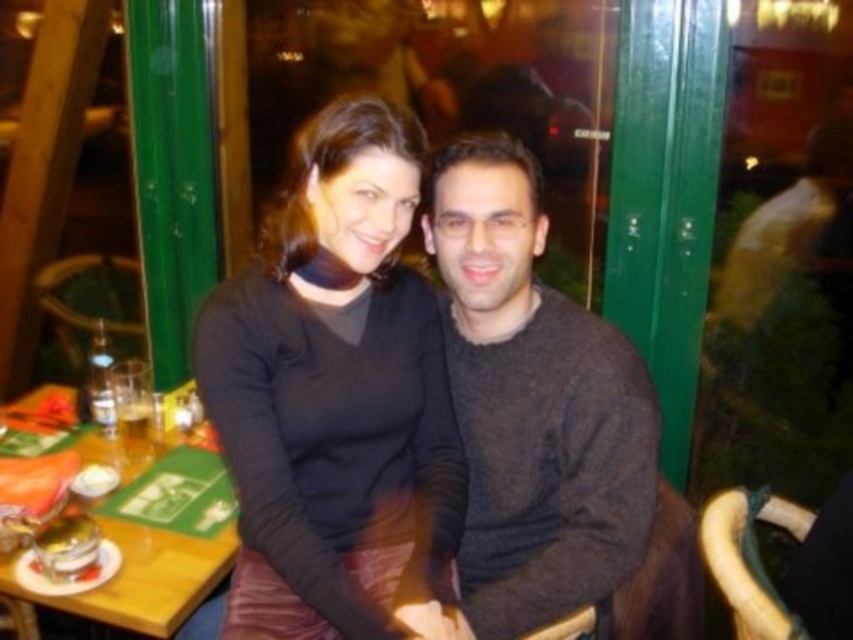
Question: Which of the following is the farthest from the observer?

Choices:
 (A) (398, 168)
 (B) (625, 394)
 (C) (161, 625)

Answer: (B)

Question: Which point appears closest to the camera in this image?

Choices:
 (A) (67, 390)
 (B) (515, 579)

Answer: (B)

Question: Is black matte sweater at center below wooden table at lower left?

Choices:
 (A) yes
 (B) no

Answer: (B)

Question: Is black matte sweater at center wider than wooden table at lower left?

Choices:
 (A) yes
 (B) no

Answer: (A)

Question: Is dark gray sweater at center to the right of wooden table at lower left from the viewer's perspective?

Choices:
 (A) no
 (B) yes

Answer: (B)

Question: Which point is closer to the camera?

Choices:
 (A) (508, 323)
 (B) (107, 451)
 (C) (384, 580)

Answer: (C)